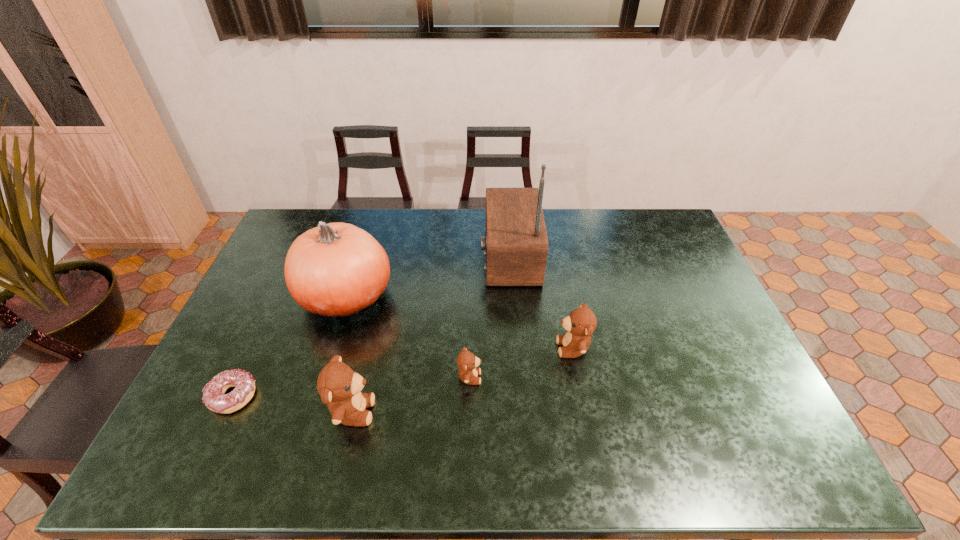
Where is `vacant space in between the pumpkin and the rightmost teddy bear`? vacant space in between the pumpkin and the rightmost teddy bear is located at coordinates (460, 322).

Locate an element on the screen. The image size is (960, 540). vacant space that is in between the rightmost teddy bear and the tallest object is located at coordinates (541, 302).

Find the location of a particular element. vacant area that lies between the second teddy bear from left to right and the fourth tallest object is located at coordinates (521, 363).

The height and width of the screenshot is (540, 960). I want to click on free space between the shortest object and the tallest object, so click(372, 326).

Image resolution: width=960 pixels, height=540 pixels. I want to click on free spot between the second shortest teddy bear and the tallest object, so click(541, 302).

You are a GUI agent. You are given a task and a screenshot of the screen. Output one action in this format:
    pyautogui.click(x=<x>, y=<y>)
    Task: Click on the vacant space that is in between the rightmost teddy bear and the shortest teddy bear
    The height and width of the screenshot is (540, 960).
    Given the screenshot: What is the action you would take?
    pyautogui.click(x=521, y=363)

Locate an element on the screen. vacant space that's between the tallest object and the shortest object is located at coordinates (372, 326).

Where is `object that stands as the fifth closest to the doughnut`? This screenshot has width=960, height=540. object that stands as the fifth closest to the doughnut is located at coordinates (581, 323).

Locate which object is the third closest to the second shortest teddy bear. Please provide its 2D coordinates. Your answer should be formatted as a tuple, i.e. [(x, y)], where the tuple contains the x and y coordinates of a point satisfying the conditions above.

[(339, 386)]

Identify which teddy bear is located as the nearest to the fifth tallest object. Please provide its 2D coordinates. Your answer should be formatted as a tuple, i.e. [(x, y)], where the tuple contains the x and y coordinates of a point satisfying the conditions above.

[(339, 386)]